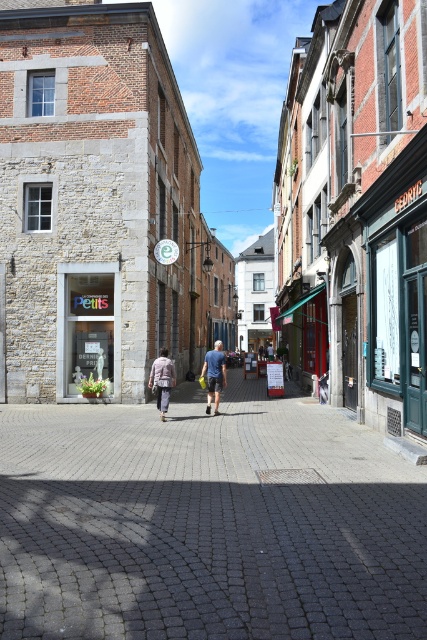
Question: Is stone building at center thinner than gray cobblestone pavement at center?

Choices:
 (A) yes
 (B) no

Answer: (B)

Question: Which is nearer to the green fabric awning at center?

Choices:
 (A) blue denim shorts at center
 (B) matte glass storefront at center
 (C) light brown fabric jacket at center
 (D) gray cobblestone pavement at center

Answer: (B)

Question: Where is stone building at center located in relation to green fabric awning at center in the image?

Choices:
 (A) left
 (B) right

Answer: (A)

Question: Is matte glass storefront at center closer to camera compared to blue denim shorts at center?

Choices:
 (A) yes
 (B) no

Answer: (B)

Question: Which point is farther to the camera?

Choices:
 (A) gray cobblestone pavement at center
 (B) green fabric awning at center
 (C) stone building at center
 (D) blue denim shorts at center

Answer: (B)

Question: Estimate the real-world distances between objects in this image. Which object is farther from the matte glass storefront at center?

Choices:
 (A) light brown fabric jacket at center
 (B) blue denim shorts at center

Answer: (A)